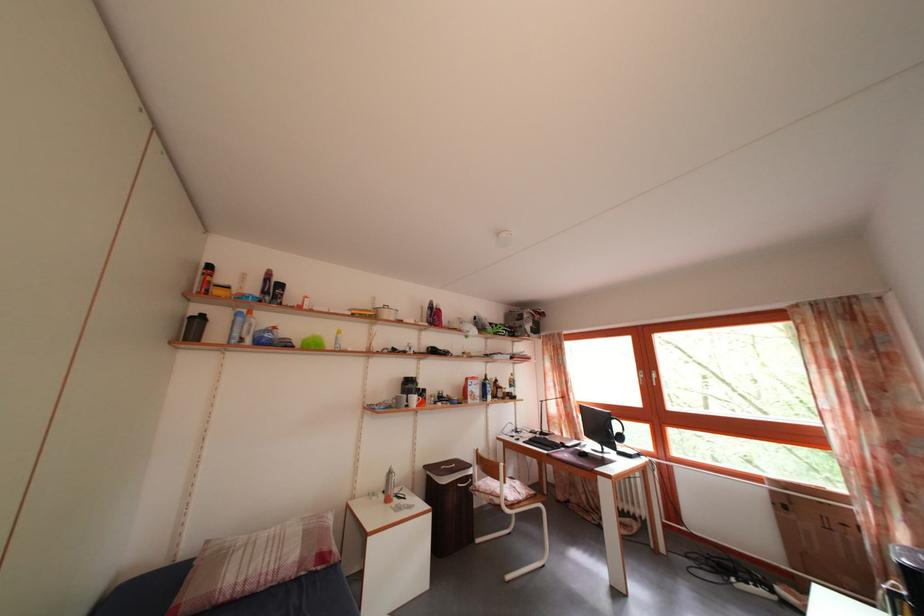
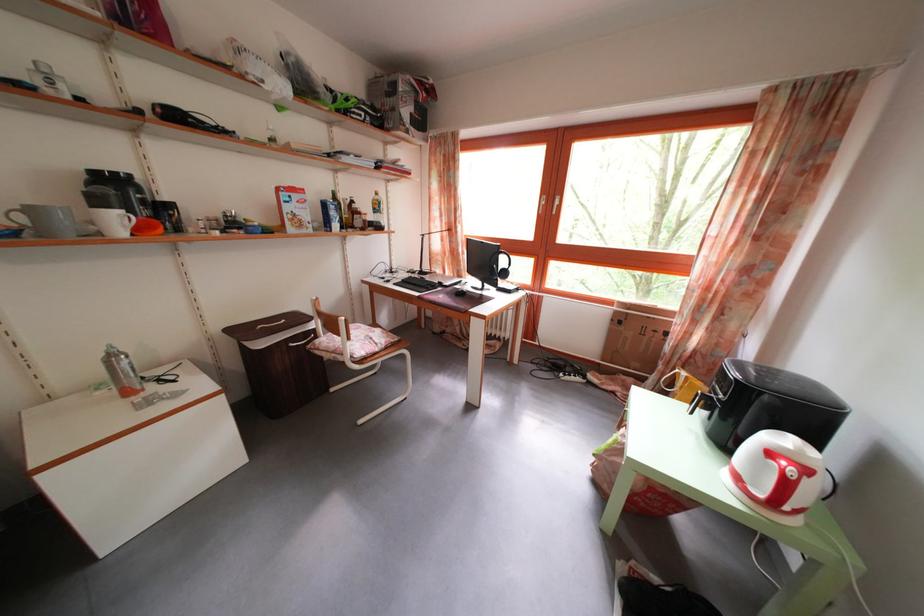
Locate, in the second image, the point that corresponds to pixel 495 392 in the first image.

(338, 214)